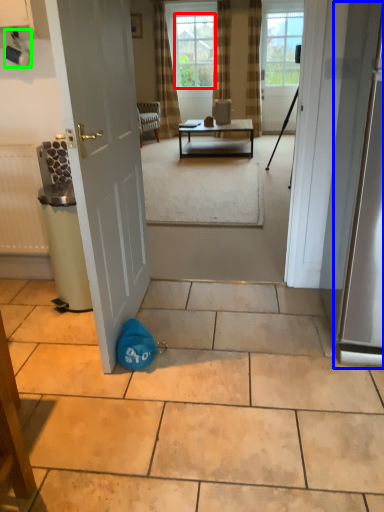
Question: Which is farther away from window screen (highlighted by a red box)? screen door (highlighted by a blue box) or coffee cup (highlighted by a green box)?

Choices:
 (A) screen door
 (B) coffee cup

Answer: (A)